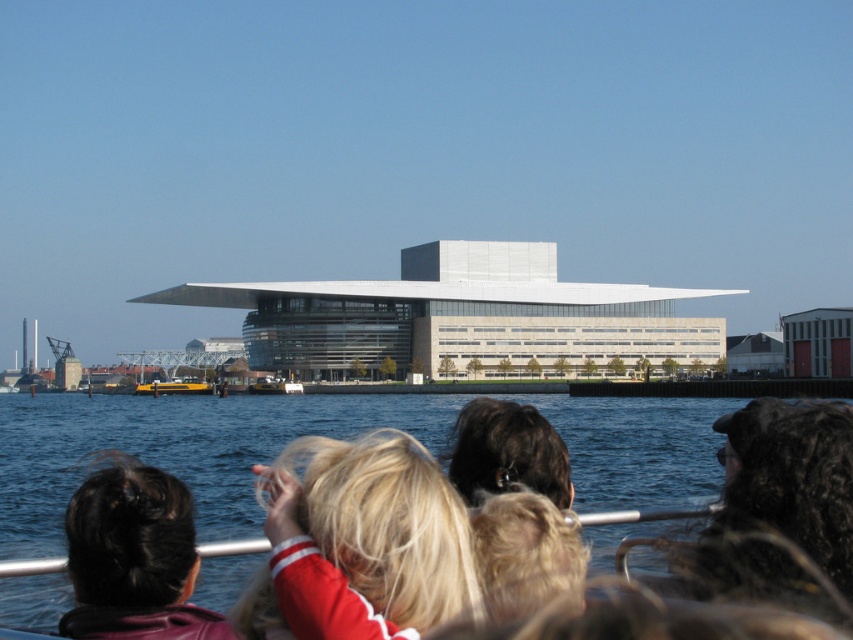
You are on a ferry looking at two people in the scene. The dark curly hair at upper right and the dark brown hair at lower left. Which person has a larger hair style?

The dark brown hair at lower left has a larger hair style than the dark curly hair at upper right.

You are on a ferry looking at a modern building across the water. There is a point at coordinates (x=363, y=541) in the image. What is located at that point?

The point at coordinates (x=363, y=541) corresponds to blonde hair at center.